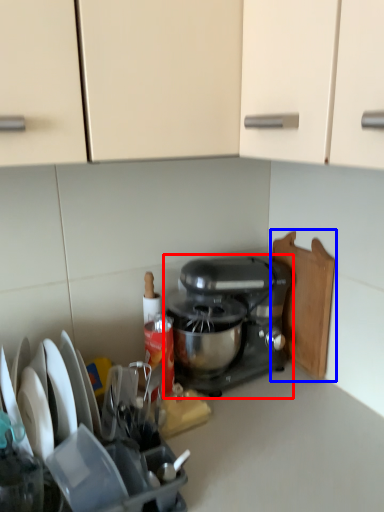
Question: Which of the following is the farthest to the observer, mixer (highlighted by a red box) or cutting board (highlighted by a blue box)?

Choices:
 (A) mixer
 (B) cutting board

Answer: (B)